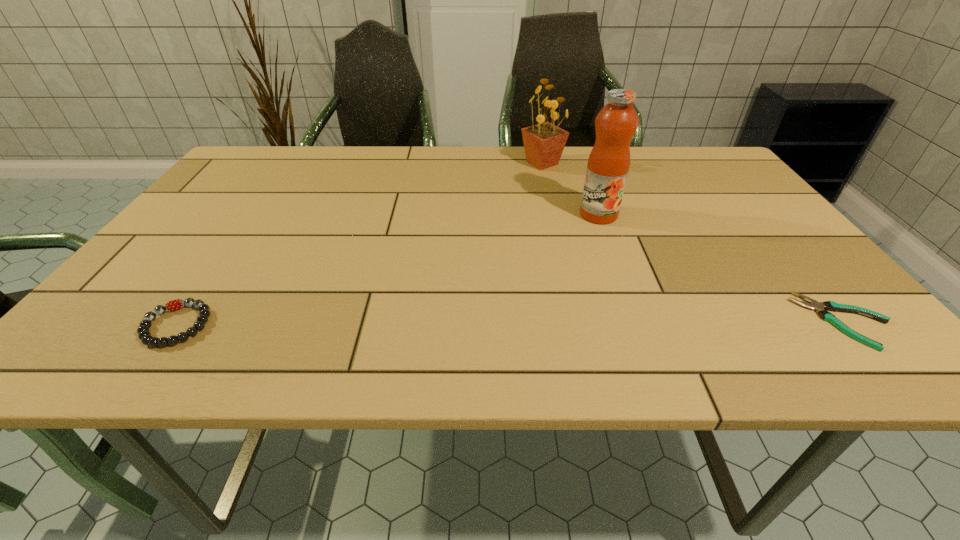
Locate an element on the screen. The image size is (960, 540). vacant spot on the desktop that is between the bracelet and the pliers and is positioned on the front label of the third nearest object is located at coordinates (588, 322).

Locate an element on the screen. This screenshot has height=540, width=960. free space on the desktop that is between the second shortest object and the rightmost object and is positioned at the front of the sunflower with flowers visible is located at coordinates (505, 323).